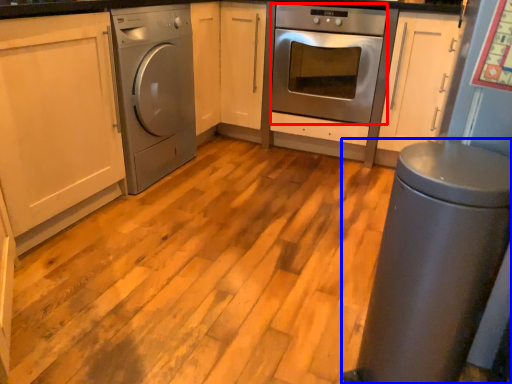
Question: Which point is closer to the camera, oven (highlighted by a red box) or gray (highlighted by a blue box)?

Choices:
 (A) oven
 (B) gray

Answer: (B)